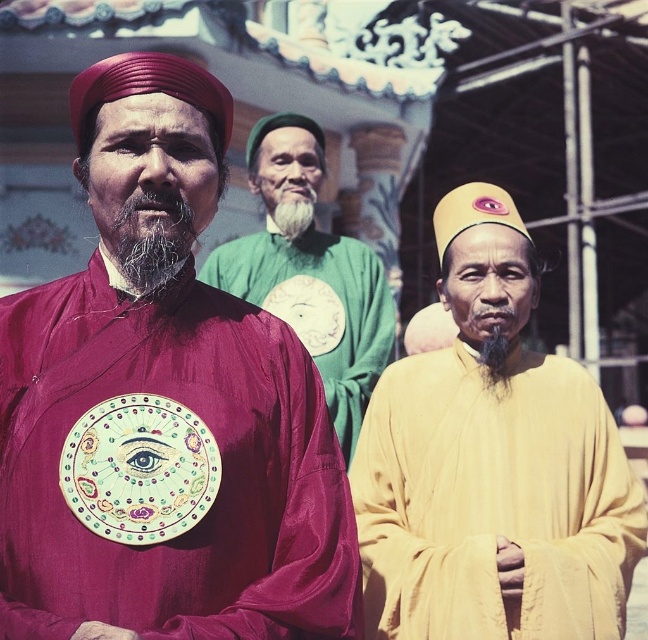
Question: Does maroon silk robe at center appear on the right side of white soft beard at center?

Choices:
 (A) no
 (B) yes

Answer: (A)

Question: Which point appears farthest from the camera in this image?

Choices:
 (A) (301, 218)
 (B) (321, 353)
 (C) (469, 355)

Answer: (A)

Question: Is maroon silk robe at center bigger than yellow matte robe at center?

Choices:
 (A) yes
 (B) no

Answer: (B)

Question: Among these points, which one is farthest from the camera?

Choices:
 (A) (209, 308)
 (B) (133, 221)

Answer: (A)

Question: Which object is the closest to the white soft beard at center?

Choices:
 (A) maroon silk robe at center
 (B) yellow matte robe at center
 (C) gray/woolly beard at center

Answer: (B)

Question: Does yellow matte robe at center come behind white soft beard at center?

Choices:
 (A) no
 (B) yes

Answer: (A)